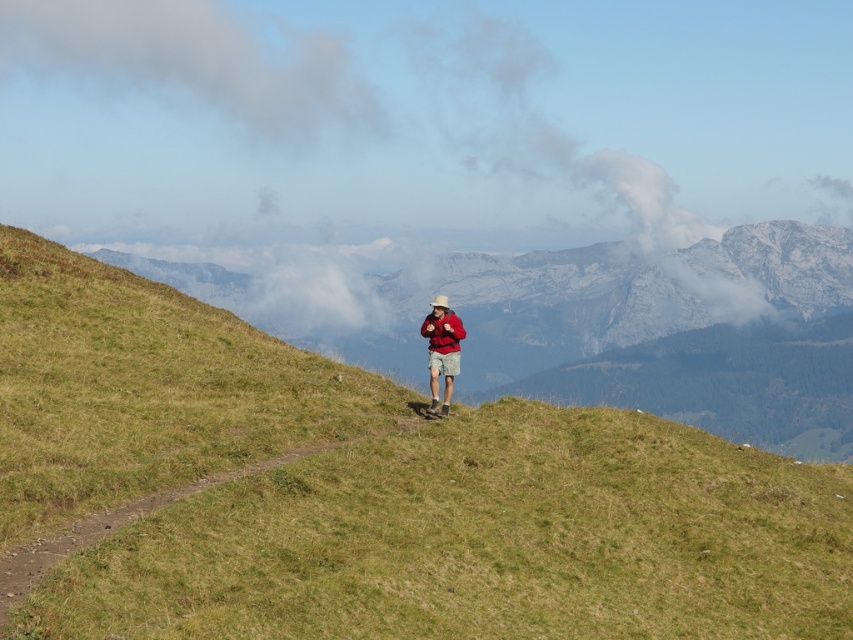
Who is more distant from viewer, (511, 404) or (20, 3)?

The point (20, 3) is more distant.

Is green grassy hillside at center to the right of gray cotton cloud at upper left from the viewer's perspective?

Correct, you'll find green grassy hillside at center to the right of gray cotton cloud at upper left.

Does point (837, 616) come in front of point (4, 58)?

Yes, point (837, 616) is closer to viewer.

This screenshot has width=853, height=640. Identify the location of green grassy hillside at center. (373, 492).

Does brown dirt path at center appear on the right side of matte red jacket at center?

In fact, brown dirt path at center is to the left of matte red jacket at center.

Does brown dirt path at center appear under matte red jacket at center?

Yes, brown dirt path at center is below matte red jacket at center.

Is point (189, 483) positioned in front of point (444, 403)?

Yes, it is in front of point (444, 403).

Image resolution: width=853 pixels, height=640 pixels. I want to click on brown dirt path at center, so click(134, 518).

The width and height of the screenshot is (853, 640). In order to click on gray cotton cloud at upper left in this screenshot , I will do coord(198,61).

Does gray cotton cloud at upper left come behind brown dirt path at center?

Yes, it is behind brown dirt path at center.

The image size is (853, 640). What do you see at coordinates (198, 61) in the screenshot? I see `gray cotton cloud at upper left` at bounding box center [198, 61].

Locate an element on the screen. The height and width of the screenshot is (640, 853). gray cotton cloud at upper left is located at coordinates (198, 61).